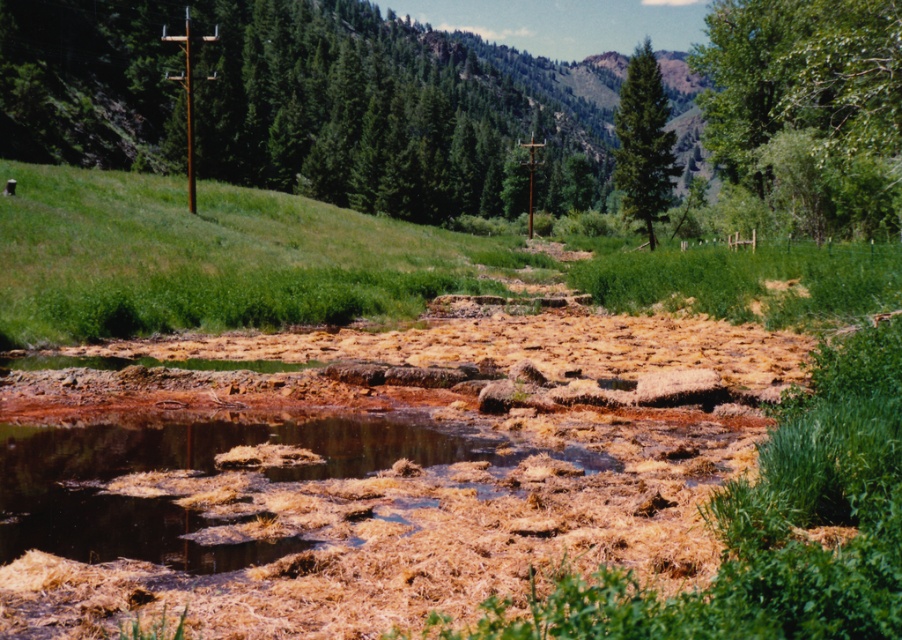
You are standing at the edge of the stream in the valley. You see a point marked at coordinates (198, 477). What is located at that point?

The point at coordinates (198, 477) indicates brown organic debris at center.

You are a hiker who wants to cross the stream using a bridge that is exactly 70 meters long. You see the brown organic debris at center and the green matte tree at upper center. Can you determine if the bridge will reach from the debris to the tree?

The brown organic debris at center is 70.50 meters from the green matte tree at upper center. Since the bridge is only 70 meters long, it will be 0.50 meters short and cannot span the distance between the brown organic debris at center and the green matte tree at upper center.

You are a hiker standing at the edge of the stream. You notice the brown organic debris at center and the green matte tree at upper center. Which object is closer to your current position?

The brown organic debris at center is closer to your current position because it is located below the green matte tree at upper center, which is further away.